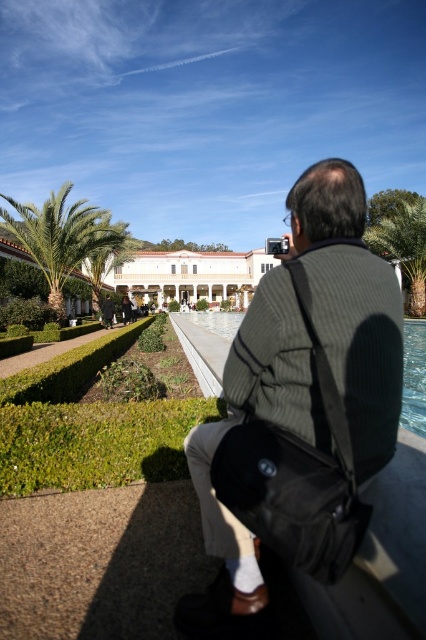
You are a fashion designer observing the man in the scene. Which item is positioned to the right side of the other between the dark gray knitted sweater at center and the matte black jacket at center?

The dark gray knitted sweater at center is positioned to the right of the matte black jacket at center.

You are a landscape architect planning to install a new pathway between the green leafy palm tree at left and the clear glass pool at center. The pathway requires a minimum of 15 meters to be functional. Based on the scene, will the available space between these two objects accommodate the pathway?

The distance between the green leafy palm tree at left and the clear glass pool at center is 15.40 meters, which exceeds the 15 meter minimum requirement. Therefore, the pathway can be installed between these two objects.